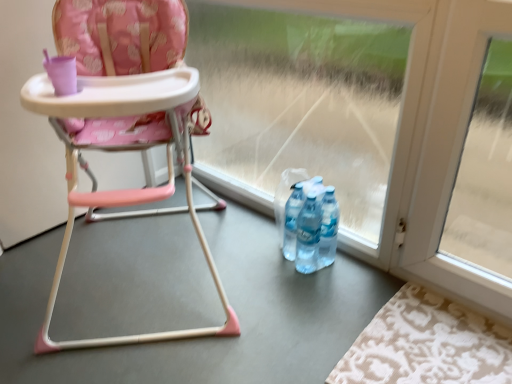
You are a GUI agent. You are given a task and a screenshot of the screen. Output one action in this format:
    pyautogui.click(x=<x>, y=<y>)
    Task: Click on the vacant space that's between transparent glass door at center and beige damask rug at lower right
    This screenshot has height=384, width=512.
    Given the screenshot: What is the action you would take?
    pyautogui.click(x=293, y=273)